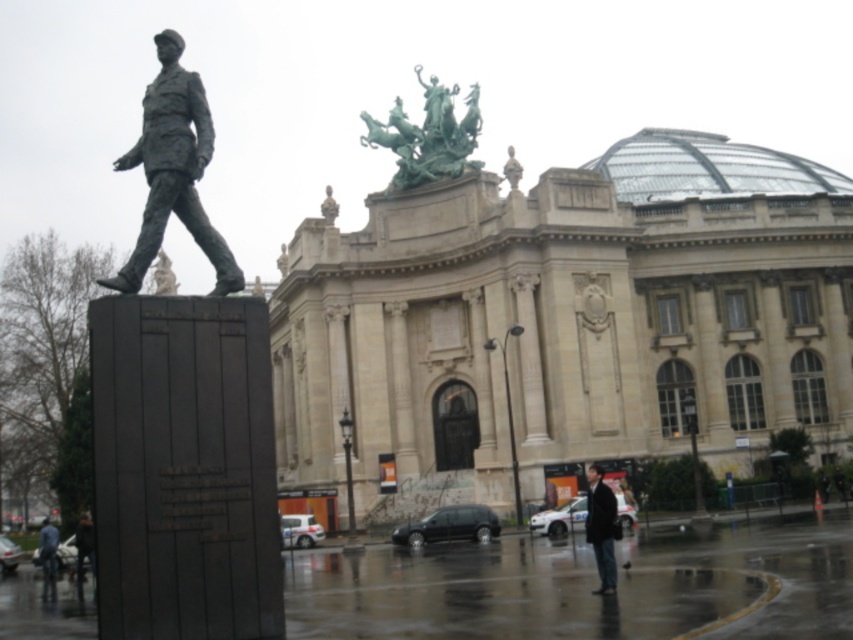
Is bronze statue at left below dark brown leather jacket at lower center?

Incorrect, bronze statue at left is not positioned below dark brown leather jacket at lower center.

Is bronze statue at left positioned in front of dark brown leather jacket at lower center?

Yes.

Does point (186, 141) lie behind point (595, 538)?

That is False.

The width and height of the screenshot is (853, 640). What are the coordinates of `bronze statue at left` in the screenshot? It's located at (173, 170).

Image resolution: width=853 pixels, height=640 pixels. Describe the element at coordinates (601, 528) in the screenshot. I see `dark brown leather jacket at lower center` at that location.

Between dark brown leather jacket at lower center and denim jacket at lower left, which one is positioned lower?

denim jacket at lower left is lower down.

Is point (596, 545) positioned after point (49, 561)?

No.

Locate an element on the screen. Image resolution: width=853 pixels, height=640 pixels. dark brown leather jacket at lower center is located at coordinates (601, 528).

Which is in front, point (457, 164) or point (49, 580)?

Point (49, 580) is more forward.

Can you confirm if green polished bronze statue at upper center is positioned to the left of denim jacket at lower left?

Incorrect, green polished bronze statue at upper center is not on the left side of denim jacket at lower left.

Find the location of a particular element. green polished bronze statue at upper center is located at coordinates (428, 134).